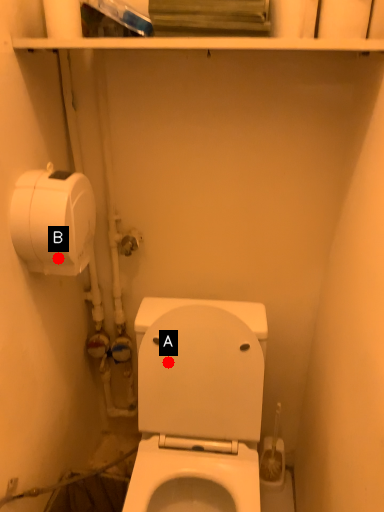
Question: Two points are circled on the image, labeled by A and B beside each circle. Which point is farther from the camera taking this photo?

Choices:
 (A) A is further
 (B) B is further

Answer: (A)